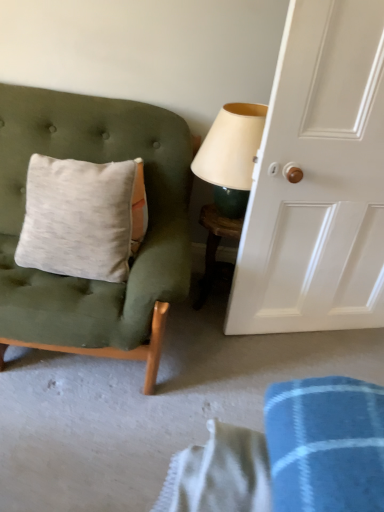
Question: Is matte cream lampshade at upper right facing towards velvet green chair at left?

Choices:
 (A) no
 (B) yes

Answer: (A)

Question: Can you confirm if matte cream lampshade at upper right is bigger than velvet green chair at left?

Choices:
 (A) yes
 (B) no

Answer: (B)

Question: Can you confirm if matte cream lampshade at upper right is thinner than velvet green chair at left?

Choices:
 (A) no
 (B) yes

Answer: (A)

Question: Does matte cream lampshade at upper right appear on the right side of velvet green chair at left?

Choices:
 (A) yes
 (B) no

Answer: (A)

Question: Is matte cream lampshade at upper right looking in the opposite direction of velvet green chair at left?

Choices:
 (A) yes
 (B) no

Answer: (B)

Question: From a real-world perspective, is matte cream lampshade at upper right physically above velvet green chair at left?

Choices:
 (A) no
 (B) yes

Answer: (B)

Question: Is matte cream lampshade at upper right at the right side of wooden table at center?

Choices:
 (A) yes
 (B) no

Answer: (A)

Question: Is matte cream lampshade at upper right beside wooden table at center?

Choices:
 (A) no
 (B) yes

Answer: (A)

Question: Would you say matte cream lampshade at upper right is outside wooden table at center?

Choices:
 (A) no
 (B) yes

Answer: (B)

Question: Is matte cream lampshade at upper right shorter than wooden table at center?

Choices:
 (A) no
 (B) yes

Answer: (B)

Question: Does matte cream lampshade at upper right have a lesser width compared to wooden table at center?

Choices:
 (A) no
 (B) yes

Answer: (A)

Question: Can wooden table at center be found inside matte cream lampshade at upper right?

Choices:
 (A) yes
 (B) no

Answer: (B)

Question: Is white glossy door at right closer to camera compared to matte cream lampshade at upper right?

Choices:
 (A) yes
 (B) no

Answer: (A)